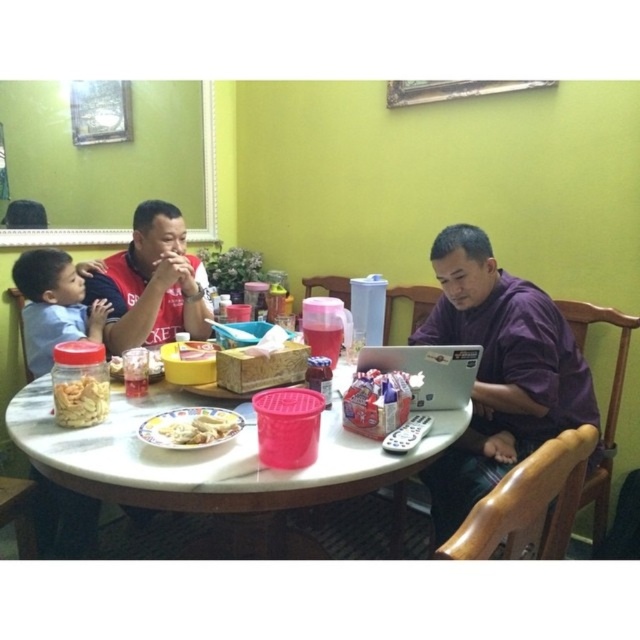
Question: From the image, what is the correct spatial relationship of white matte plate at center in relation to yellow matte plastic container at center?

Choices:
 (A) left
 (B) right

Answer: (B)

Question: Which object is positioned farthest from the satin silver laptop at center?

Choices:
 (A) purple matte shirt at center
 (B) matte red shirt at center

Answer: (B)

Question: Estimate the real-world distances between objects in this image. Which object is farther from the white marble table at center?

Choices:
 (A) yellow matte plastic container at center
 (B) satin silver laptop at center
 (C) smooth blue shirt at left

Answer: (C)

Question: Can you confirm if white marble table at center is positioned below satin silver laptop at center?

Choices:
 (A) no
 (B) yes

Answer: (B)

Question: Which point is closer to the camera?

Choices:
 (A) purple matte shirt at center
 (B) satin silver laptop at center
 (C) matte red shirt at center

Answer: (B)

Question: Considering the relative positions of purple matte laptop at center and yellow matte plastic container at center in the image provided, where is purple matte laptop at center located with respect to yellow matte plastic container at center?

Choices:
 (A) below
 (B) above

Answer: (A)